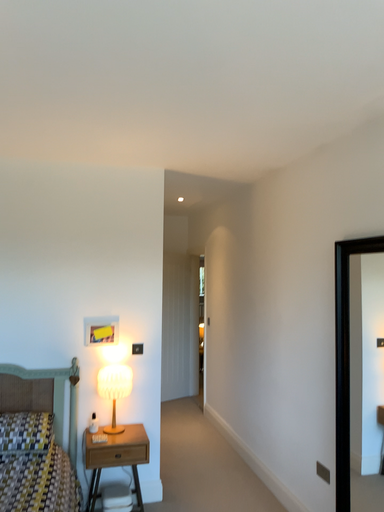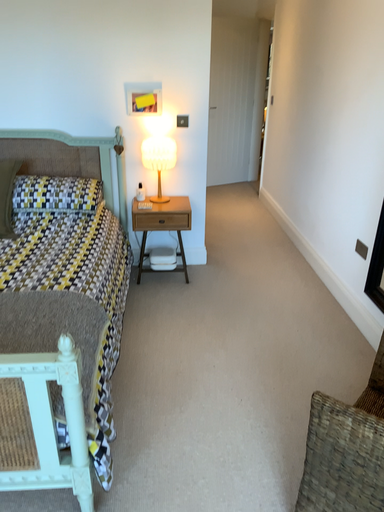
Question: Which way did the camera rotate in the video?

Choices:
 (A) rotated right
 (B) rotated left

Answer: (B)